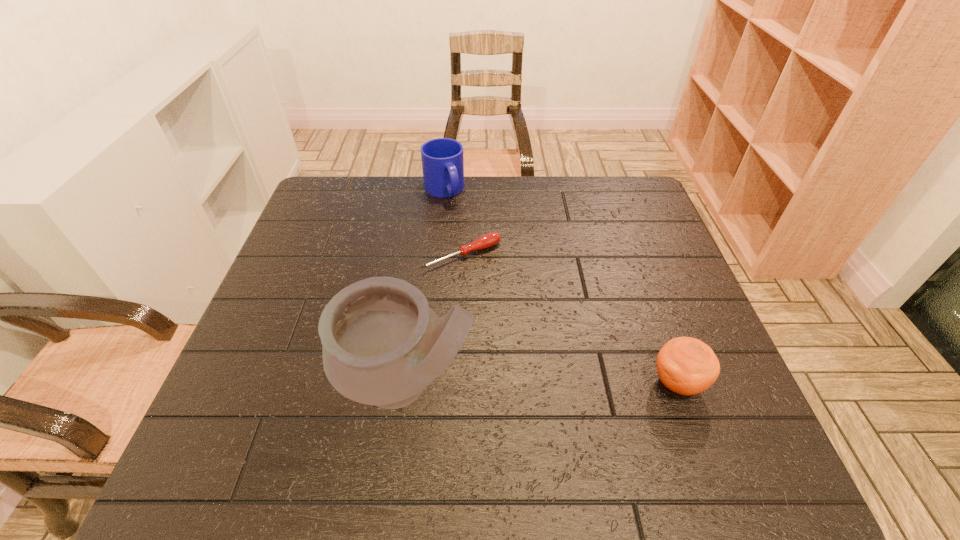
At what (x,y) coordinates should I click in order to perform the action: click on vacant space on the desktop that is between the pottery and the rightmost object and is positioned at the tip of the screwdriver. Please return your answer as a coordinate pair (x, y). Looking at the image, I should click on [x=573, y=382].

Locate an element on the screen. free space on the desktop that is between the tallest object and the rightmost object and is positioned on the side with the handle of the farthest object is located at coordinates (562, 382).